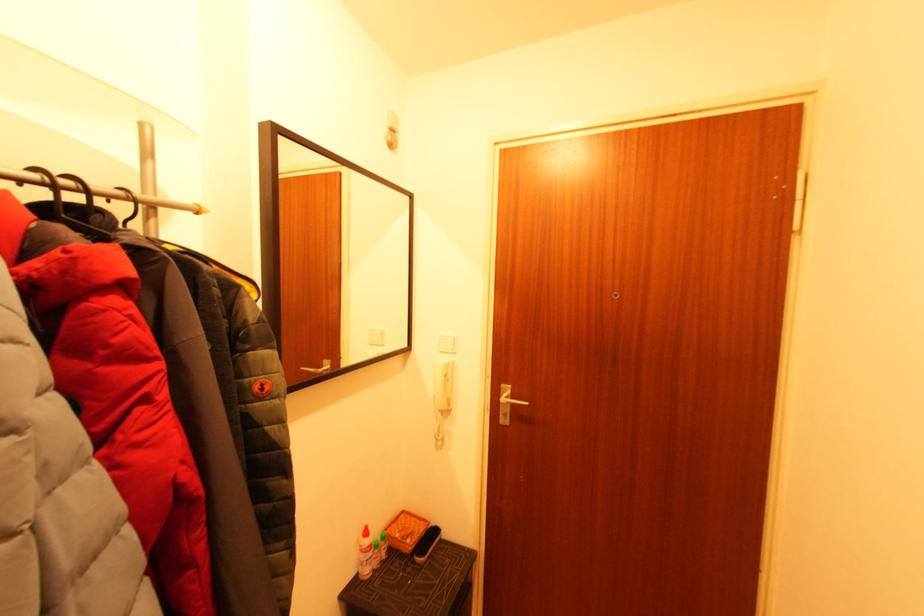
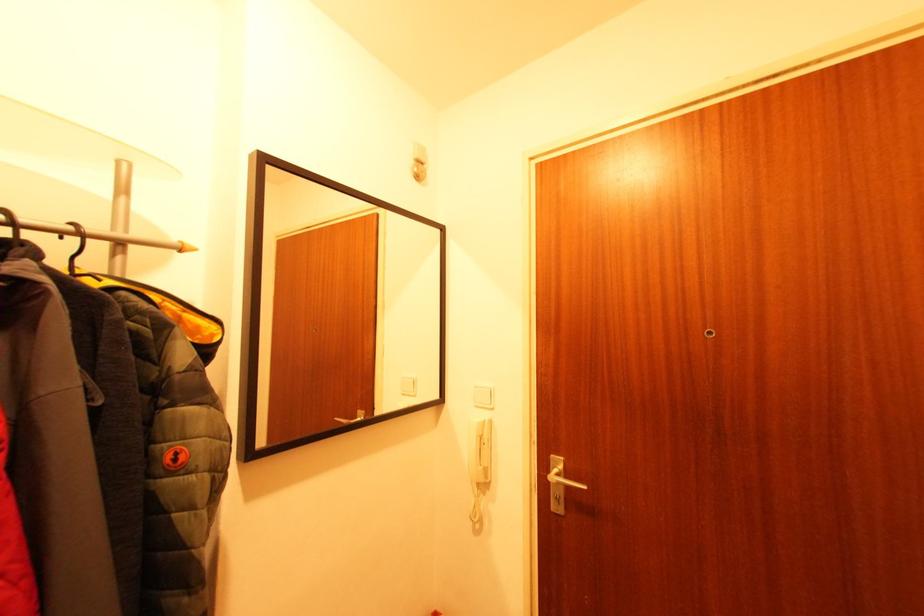
In the second image, find the point that corresponds to (91,193) in the first image.

(19, 225)